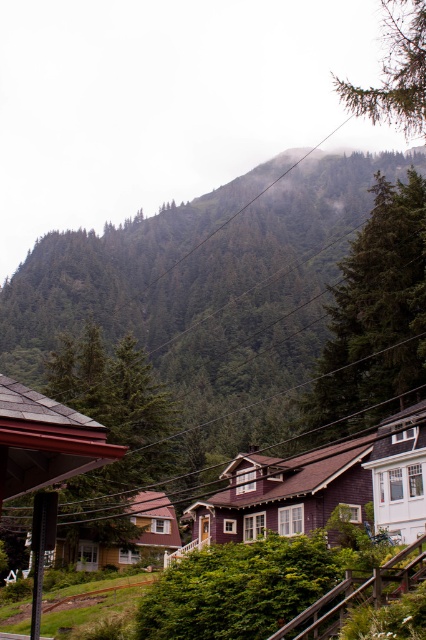
Between white wood house at right and brown wooden train track at lower center, which one is positioned higher?

Positioned higher is white wood house at right.

Is white wood house at right taller than brown wooden train track at lower center?

Yes.

Who is more distant from viewer, (388, 451) or (86, 596)?

Positioned behind is point (86, 596).

Identify the location of white wood house at right. The height and width of the screenshot is (640, 426). (400, 474).

Which of these two, matte red roof at lower left or white wood house at right, stands shorter?

matte red roof at lower left is shorter.

Can you confirm if matte red roof at lower left is positioned to the right of white wood house at right?

No, matte red roof at lower left is not to the right of white wood house at right.

You are a GUI agent. You are given a task and a screenshot of the screen. Output one action in this format:
    pyautogui.click(x=<x>, y=<y>)
    Task: Click on the matte red roof at lower left
    The image size is (426, 640).
    Given the screenshot: What is the action you would take?
    pyautogui.click(x=45, y=440)

Who is shorter, green textured tree at upper center or purple wood house at center?

Standing shorter between the two is purple wood house at center.

Is green textured tree at upper center to the left of purple wood house at center from the viewer's perspective?

Incorrect, green textured tree at upper center is not on the left side of purple wood house at center.

Based on the photo, who is more forward, (339,353) or (242,540)?

Point (242,540) is in front.

What are the coordinates of `green textured tree at upper center` in the screenshot? It's located at (374, 314).